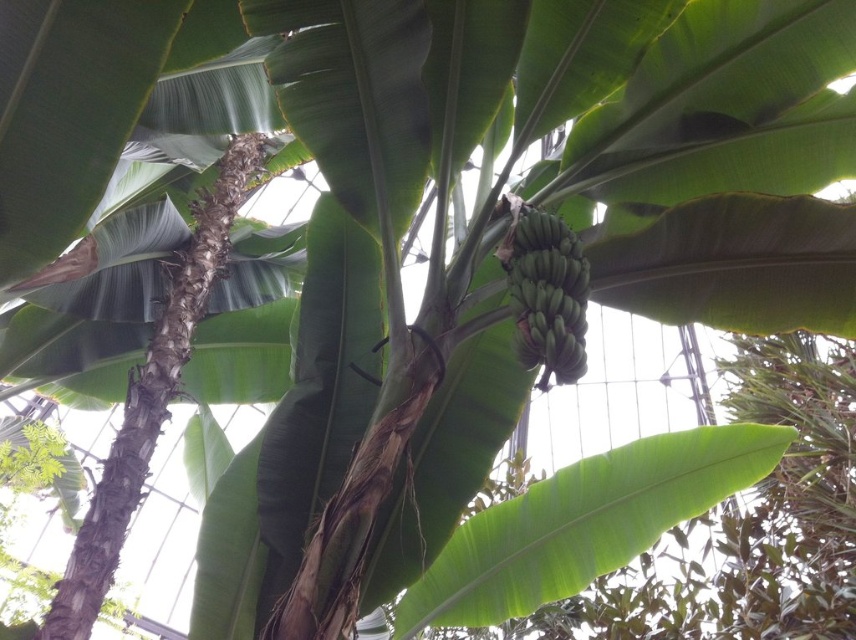
You are standing in a glasshouse and want to reach the banana plant cluster at the center. The point you are currently standing at is marked as point (621, 449). If you are 3.40 meters away from this point, can you comfortably reach the bananas?

The distance between you and point (621, 449) is 3.40 meters. Since the bananas are at the center of the plant, you would need to be closer to reach them. Therefore, you are too far away to comfortably reach the bananas.

You are standing in a glasshouse and want to take a photo of the banana plant. There is a specific point at coordinates point (625, 513) that you need to focus on. If your camera can focus on objects up to 3 meters away, will it be able to focus on that point?

The distance of point (625, 513) from the camera is 3.31 meters, which is beyond the camera focus range of 3 meters. Therefore, the camera cannot focus on that point.

You are a gardener trying to identify the leaves on the banana plant. Which leaf has a greater width between the green smooth leaf at center and the green matte leaf at left?

The green smooth leaf at center has a greater width than the green matte leaf at left.